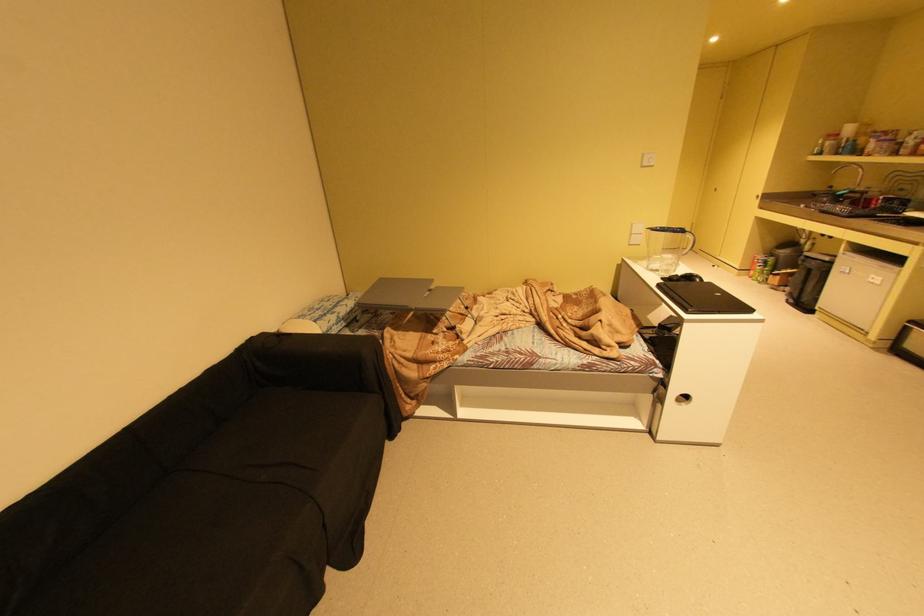
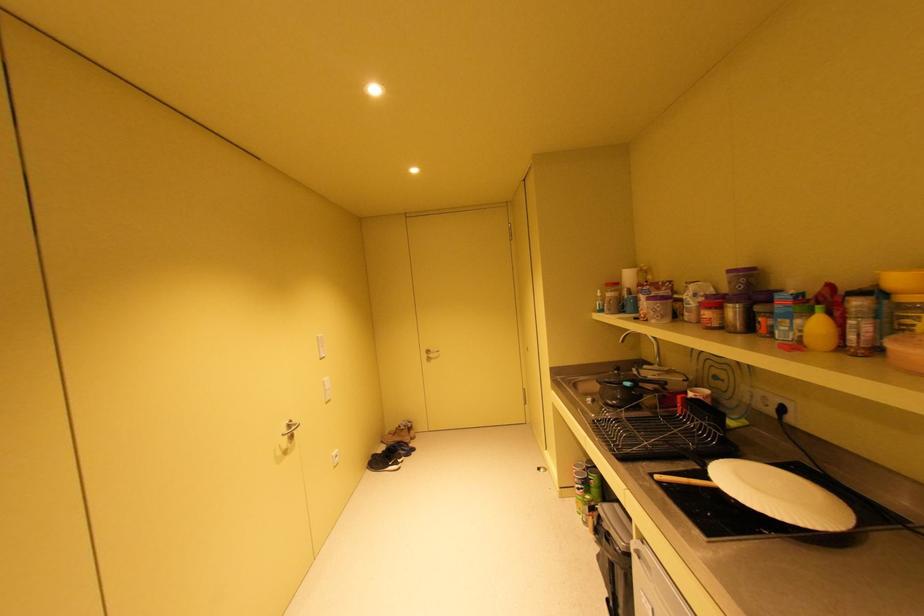
Which direction would the cameraman need to move to produce the second image?

The cameraman walked toward right, forward.